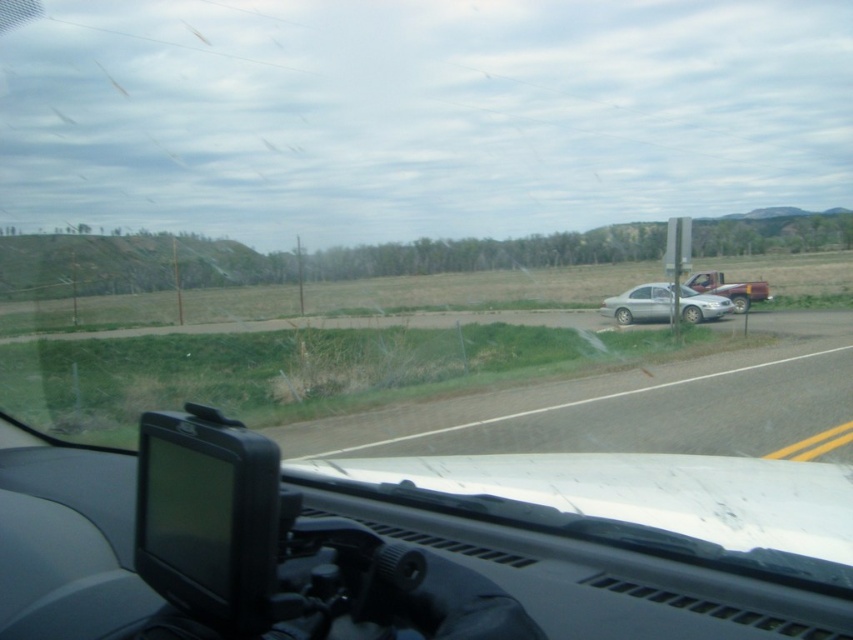
Question: Considering the relative positions of satin silver sedan at right and matte red truck at right in the image provided, where is satin silver sedan at right located with respect to matte red truck at right?

Choices:
 (A) left
 (B) right

Answer: (A)

Question: Is satin silver sedan at right positioned in front of matte red truck at right?

Choices:
 (A) yes
 (B) no

Answer: (A)

Question: Can you confirm if satin silver sedan at right is positioned to the left of matte red truck at right?

Choices:
 (A) no
 (B) yes

Answer: (B)

Question: Among these objects, which one is farthest from the camera?

Choices:
 (A) matte red truck at right
 (B) satin silver sedan at right

Answer: (A)